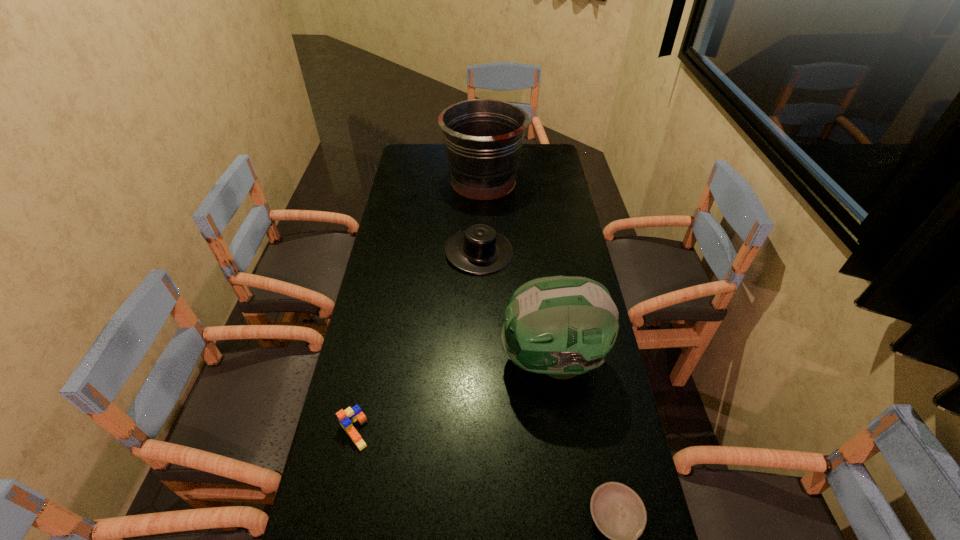
Locate an element on the screen. This screenshot has width=960, height=540. bucket is located at coordinates (483, 138).

The image size is (960, 540). Find the location of `football helmet`. football helmet is located at coordinates (562, 326).

Identify the location of dress hat. Image resolution: width=960 pixels, height=540 pixels. (479, 249).

The image size is (960, 540). Find the location of `the third tallest object`. the third tallest object is located at coordinates (479, 249).

Locate an element on the screen. This screenshot has height=540, width=960. the fourth tallest object is located at coordinates (347, 417).

Find the location of `the fourth farthest object`. the fourth farthest object is located at coordinates (347, 417).

Locate an element on the screen. vacant space located on the back of the farthest object is located at coordinates (483, 152).

Find the location of a particular element. vacant area located on the visor of the third nearest object is located at coordinates (422, 360).

I want to click on free region located 0.100m on the visor of the third nearest object, so click(465, 360).

Identify the location of free space located 0.110m on the visor of the third nearest object. (461, 360).